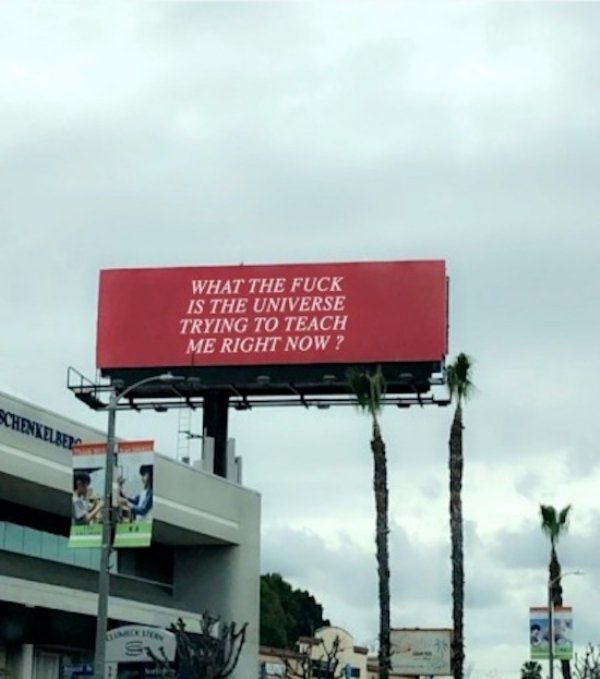
The height and width of the screenshot is (679, 600). I want to click on windows, so click(x=55, y=540), click(x=51, y=661), click(x=146, y=565).